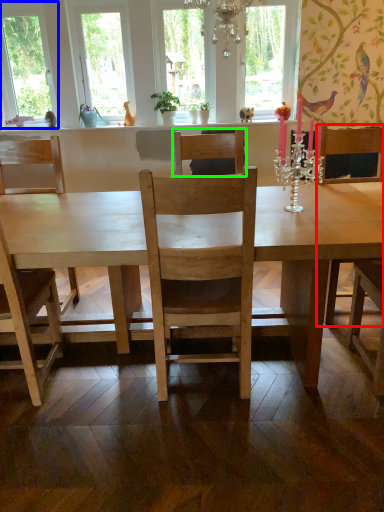
Question: Considering the real-world distances, which object is closest to armchair (highlighted by a red box)? window (highlighted by a blue box) or chair (highlighted by a green box).

Choices:
 (A) window
 (B) chair

Answer: (B)